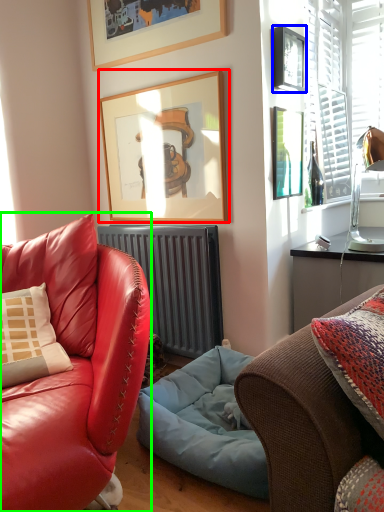
Question: Which object is the farthest from picture frame (highlighted by a red box)? Choose among these: picture frame (highlighted by a blue box) or studio couch (highlighted by a green box).

Choices:
 (A) picture frame
 (B) studio couch

Answer: (B)